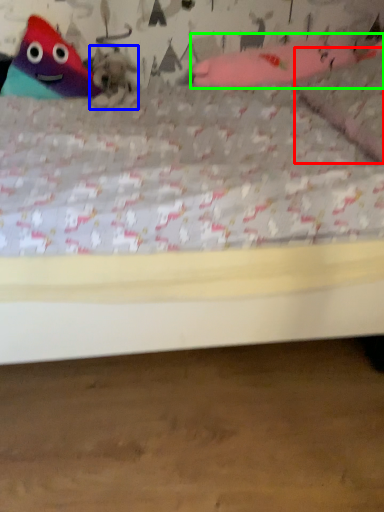
Question: Based on their relative distances, which object is nearer to pillow (highlighted by a red box)? Choose from animal (highlighted by a blue box) and toy (highlighted by a green box).

Choices:
 (A) animal
 (B) toy

Answer: (B)